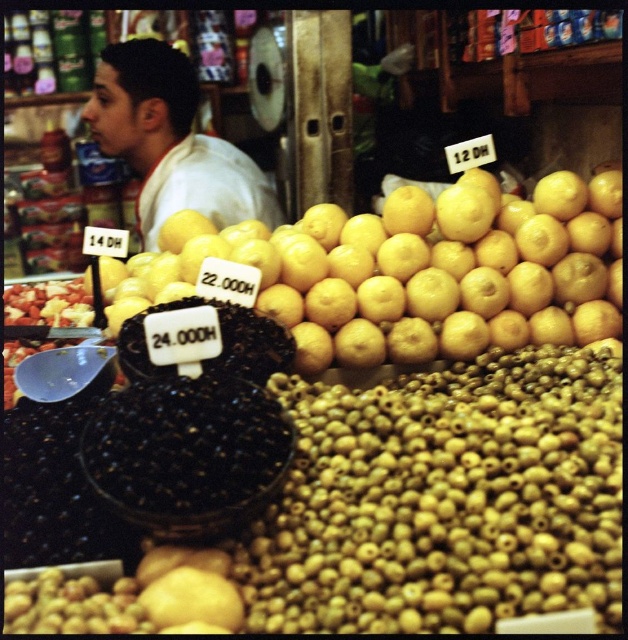
Question: Is yellow matte orange at center to the right of white matte shirt at upper left from the viewer's perspective?

Choices:
 (A) yes
 (B) no

Answer: (A)

Question: Which point appears closest to the camera in this image?

Choices:
 (A) (163, 184)
 (B) (121, 269)

Answer: (B)

Question: Is yellow matte orange at center bigger than white matte shirt at upper left?

Choices:
 (A) yes
 (B) no

Answer: (A)

Question: Which of the following is the closest to the observer?

Choices:
 (A) white matte shirt at upper left
 (B) yellow matte orange at center

Answer: (B)

Question: Does yellow matte orange at center come in front of white matte shirt at upper left?

Choices:
 (A) yes
 (B) no

Answer: (A)